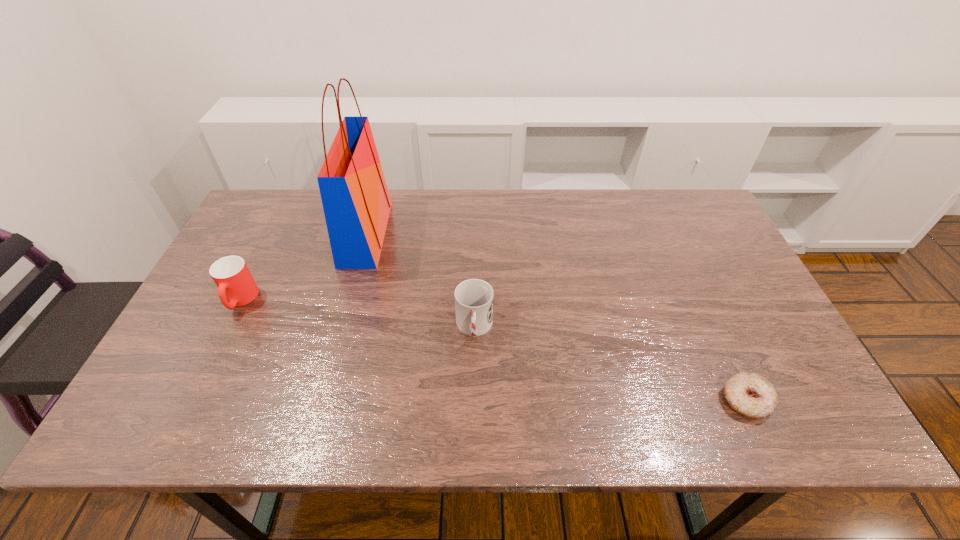
This screenshot has height=540, width=960. Identify the location of free space between the left cup and the nearest object. (493, 350).

Find the location of `free point between the nearest object and the left cup`. free point between the nearest object and the left cup is located at coordinates (493, 350).

Identify which object is located as the nearest to the shortest object. Please provide its 2D coordinates. Your answer should be formatted as a tuple, i.e. [(x, y)], where the tuple contains the x and y coordinates of a point satisfying the conditions above.

[(473, 298)]

Where is `object that stands as the third closest to the third object from right to left`? The image size is (960, 540). object that stands as the third closest to the third object from right to left is located at coordinates (749, 394).

Identify the location of vacant space that satisfies the following two spatial constraints: 1. on the side of the leftmost object with the handle; 2. on the right side of the doughnut. (191, 400).

Locate an element on the screen. Image resolution: width=960 pixels, height=540 pixels. vacant area that satisfies the following two spatial constraints: 1. on the side of the rightmost object with the handle; 2. on the right side of the left cup is located at coordinates (191, 400).

Find the location of a particular element. vacant point that satisfies the following two spatial constraints: 1. on the handle side of the tallest object; 2. on the side of the leftmost object with the handle is located at coordinates (348, 300).

I want to click on free region that satisfies the following two spatial constraints: 1. on the handle side of the right cup; 2. on the right side of the doughnut, so click(473, 400).

This screenshot has height=540, width=960. What are the coordinates of `vacant position in the image that satisfies the following two spatial constraints: 1. on the handle side of the nearest object; 2. on the left side of the shopping bag` in the screenshot? It's located at (321, 400).

The height and width of the screenshot is (540, 960). What are the coordinates of `free space that satisfies the following two spatial constraints: 1. on the handle side of the third object from right to left; 2. on the side of the leftmost object with the handle` in the screenshot? It's located at (348, 300).